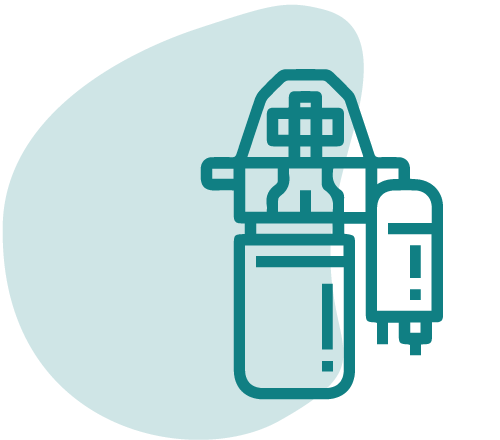
At what (x,y) coordinates should I click in order to perform the action: click on bar. Please return your answer as a coordinate pair (x, y). The image size is (500, 440). Looking at the image, I should click on (226, 174).